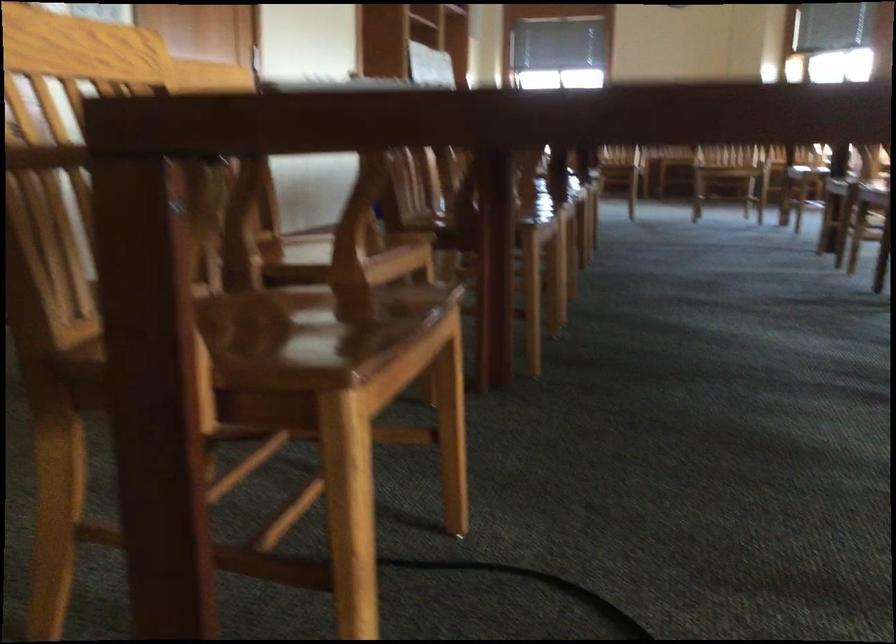
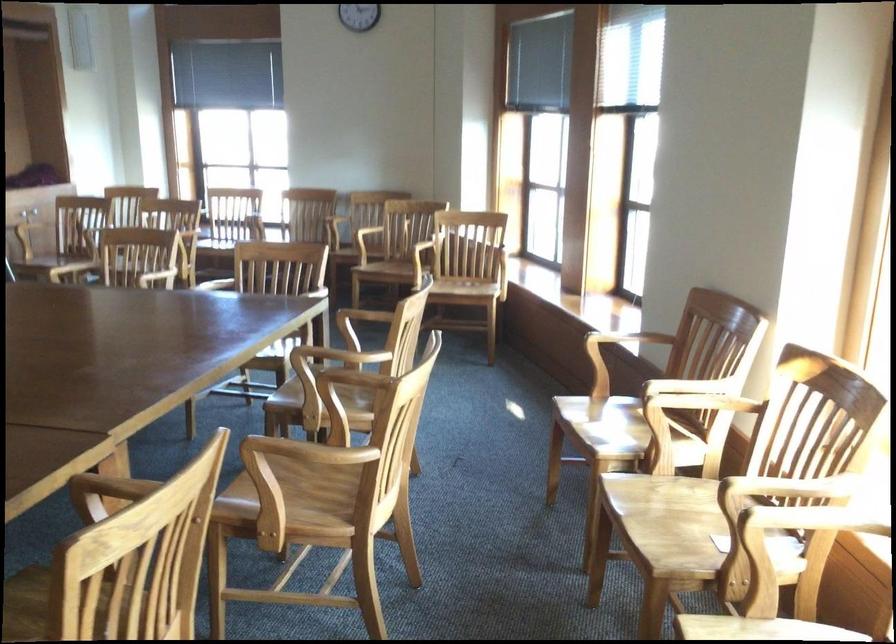
What movement of the cameraman would produce the second image?

The movement direction of the cameraman is right, forward.